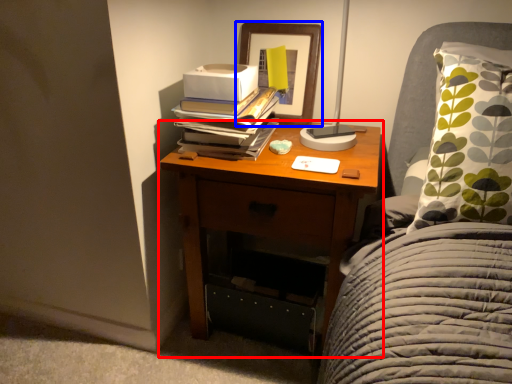
Question: Which of the following is the closest to the observer, nightstand (highlighted by a red box) or picture frame (highlighted by a blue box)?

Choices:
 (A) nightstand
 (B) picture frame

Answer: (A)